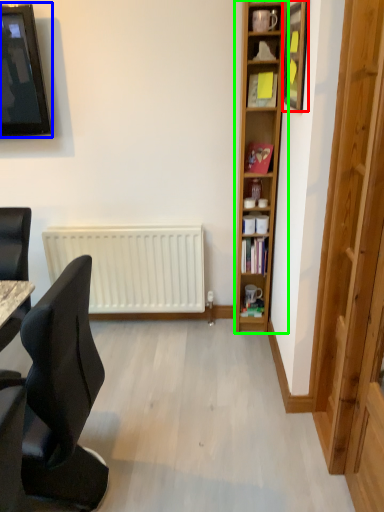
Question: Based on their relative distances, which object is nearer to picture frame (highlighted by a red box)? Choose from television (highlighted by a blue box) and bookcase (highlighted by a green box).

Choices:
 (A) television
 (B) bookcase

Answer: (B)